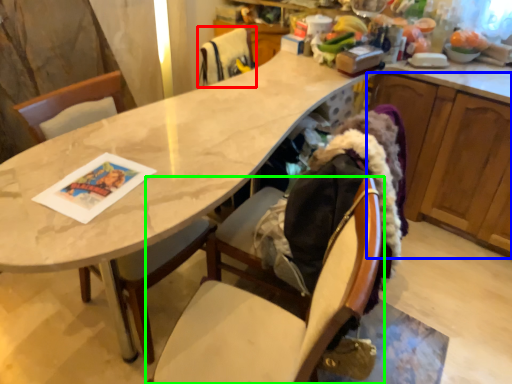
Question: Which is farther away from chair (highlighted by a red box)? cabinetry (highlighted by a blue box) or chair (highlighted by a green box)?

Choices:
 (A) cabinetry
 (B) chair

Answer: (B)